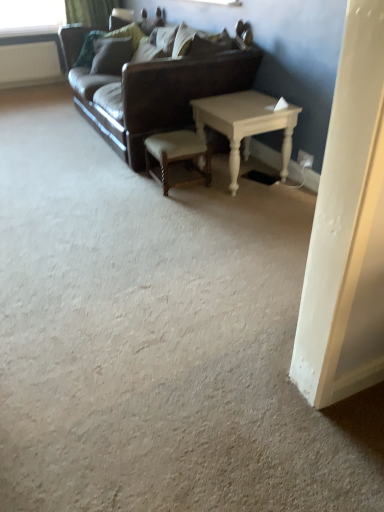
Question: Does point (16, 68) appear closer or farther from the camera than point (119, 45)?

Choices:
 (A) farther
 (B) closer

Answer: (A)

Question: Would you say white plastic radiator at upper left is inside or outside velvet green pillow at upper center, acting as the 1th pillow starting from the back?

Choices:
 (A) outside
 (B) inside

Answer: (A)

Question: Considering the real-world distances, which object is closest to the white plastic radiator at upper left?

Choices:
 (A) green fabric curtain at upper left
 (B) leather couch at center
 (C) velvet green pillow at upper center, the 1th pillow viewed from the left
 (D) wooden polished stool at center
 (E) suede-like beige pillow at upper center, which is the 2th pillow from left to right

Answer: (A)

Question: Which object is the closest to the suede-like beige pillow at upper center, acting as the first pillow starting from the right?

Choices:
 (A) white plastic radiator at upper left
 (B) leather couch at center
 (C) green fabric curtain at upper left
 (D) wooden polished stool at center
 (E) white wood table at center

Answer: (B)